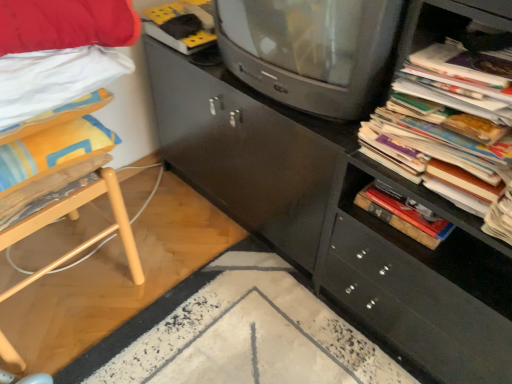
Image resolution: width=512 pixels, height=384 pixels. Describe the element at coordinates (311, 51) in the screenshot. I see `matte gray television at center` at that location.

Based on the photo, in order to face stacked paper at right, should I rotate leftwards or rightwards?

Turn right by 24.460 degrees to look at stacked paper at right.

Locate an element on the screen. The image size is (512, 384). light wood chair at left is located at coordinates (76, 218).

Which is closer to the camera, (507, 8) or (387, 16)?

Point (507, 8) is closer to the camera than point (387, 16).

Is stacked paper at right positioned with its back to matte gray television at center?

No, matte gray television at center is not at the back of stacked paper at right.

In terms of width, does stacked paper at right look wider or thinner when compared to matte gray television at center?

In the image, stacked paper at right appears to be wider than matte gray television at center.

Between stacked paper at right and matte gray television at center, which one has less height?

stacked paper at right is shorter.

Is matte black cabinet at center completely or partially outside of stacked paper at right?

Yes, matte black cabinet at center is not within stacked paper at right.

Considering the sizes of objects matte black cabinet at center and stacked paper at right in the image provided, who is thinner, matte black cabinet at center or stacked paper at right?

stacked paper at right is thinner.

From a real-world perspective, is matte black cabinet at center on stacked paper at right?

Actually, matte black cabinet at center is physically below stacked paper at right in the real world.

Are matte black cabinet at center and stacked paper at right making contact?

They are not placed beside each other.

Is there a large distance between matte black cabinet at center and light wood chair at left?

That's not correct — matte black cabinet at center is a little close to light wood chair at left.

From a real-world perspective, between matte black cabinet at center and light wood chair at left, who is vertically lower?

light wood chair at left, from a real-world perspective.

Find the location of a particular element. The image size is (512, 384). furniture on the left of the matte black cabinet at center is located at coordinates (76, 218).

Could you tell me if matte black cabinet at center is facing light wood chair at left?

Yes, matte black cabinet at center is aimed at light wood chair at left.

In the image, is matte gray television at center on the left side or the right side of light wood chair at left?

Based on their positions, matte gray television at center is located to the right of light wood chair at left.

Can you see matte gray television at center touching light wood chair at left?

matte gray television at center and light wood chair at left are not in contact.

Identify the location of furniture that is under the matte gray television at center (from a real-world perspective). Image resolution: width=512 pixels, height=384 pixels. (76, 218).

Could you tell me if matte gray television at center is facing light wood chair at left?

No, matte gray television at center does not turn towards light wood chair at left.

From the image's perspective, is light wood chair at left under stacked paper at right?

Yes.

Measure the distance from light wood chair at left to stacked paper at right.

light wood chair at left and stacked paper at right are 29.53 inches apart.

Is light wood chair at left oriented away from stacked paper at right?

No.

Is point (75, 216) farther from camera compared to point (479, 237)?

Yes, point (75, 216) is farther from viewer.

What's the angular difference between matte gray television at center and stacked paper at right's facing directions?

9.4 degrees separate the facing orientations of matte gray television at center and stacked paper at right.

In the image, is matte gray television at center on the left side or the right side of stacked paper at right?

In the image, matte gray television at center appears on the left side of stacked paper at right.

Does matte gray television at center come in front of stacked paper at right?

That is False.

Is matte gray television at center facing away from stacked paper at right?

That's not correct — matte gray television at center is not looking away from stacked paper at right.

Looking at this image, from the image's perspective, is stacked paper at right above or below light wood chair at left?

stacked paper at right is above light wood chair at left.

Considering the relative sizes of stacked paper at right and light wood chair at left in the image provided, is stacked paper at right bigger than light wood chair at left?

Incorrect, stacked paper at right is not larger than light wood chair at left.

From a real-world perspective, is stacked paper at right on light wood chair at left?

Correct, in the physical world, stacked paper at right is higher than light wood chair at left.

Find the location of a particular element. The image size is (512, 384). shelf in front of the matte gray television at center is located at coordinates (434, 33).

Where is `shelf on the right of matte black cabinet at center`? The width and height of the screenshot is (512, 384). shelf on the right of matte black cabinet at center is located at coordinates (434, 33).

Which object lies further to the anchor point matte black cabinet at center, light wood chair at left or matte gray television at center?

The object further to matte black cabinet at center is light wood chair at left.

Looking at the image, which one is located closer to light wood chair at left, stacked paper at right or matte gray television at center?

Based on the image, matte gray television at center appears to be nearer to light wood chair at left.

Based on their spatial positions, is matte gray television at center or light wood chair at left closer to stacked paper at right?

matte gray television at center is positioned closer to the anchor stacked paper at right.

Estimate the real-world distances between objects in this image. Which object is closer to stacked paper at right, matte black cabinet at center or matte gray television at center?

Based on the image, matte gray television at center appears to be nearer to stacked paper at right.

Based on their spatial positions, is matte gray television at center or matte black cabinet at center further from stacked paper at right?

matte black cabinet at center lies further to stacked paper at right than the other object.

Considering their positions, is matte gray television at center positioned closer to light wood chair at left than matte black cabinet at center?

matte gray television at center is positioned closer to the anchor light wood chair at left.

Based on their spatial positions, is stacked paper at right or light wood chair at left further from matte gray television at center?

Among the two, light wood chair at left is located further to matte gray television at center.

When comparing their distances from light wood chair at left, does matte black cabinet at center or stacked paper at right seem closer?

matte black cabinet at center lies closer to light wood chair at left than the other object.

Locate an element on the screen. The image size is (512, 384). television between light wood chair at left and stacked paper at right from left to right is located at coordinates (311, 51).

I want to click on shelf located between matte black cabinet at center and matte gray television at center in the depth direction, so click(x=434, y=33).

I want to click on television between light wood chair at left and matte black cabinet at center, so click(311, 51).

At what (x,y) coordinates should I click in order to perform the action: click on cabinetry between light wood chair at left and stacked paper at right. Please return your answer as a coordinate pair (x, y). Looking at the image, I should click on (334, 213).